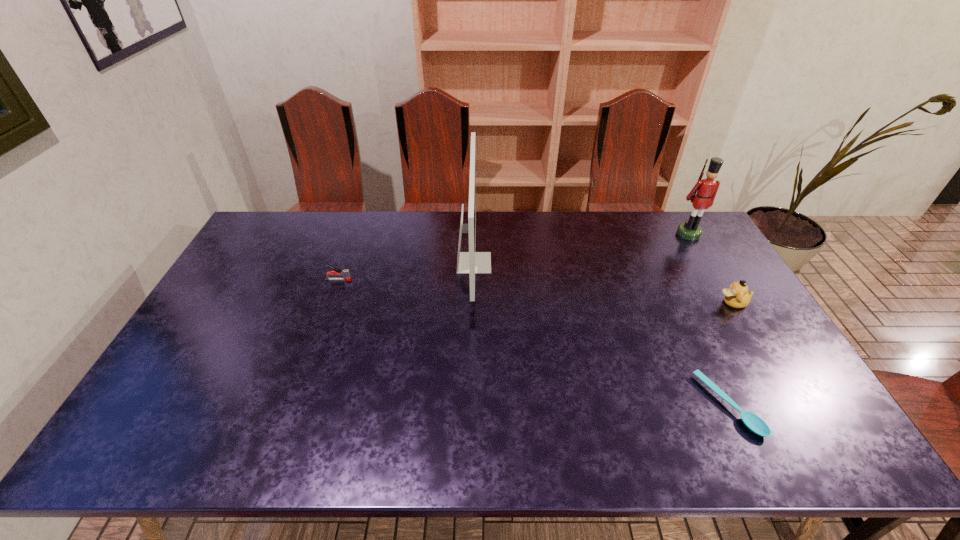
The height and width of the screenshot is (540, 960). Identify the location of vacant point located between the duckling and the third object from right to left. (730, 354).

Locate an element on the screen. The height and width of the screenshot is (540, 960). free space between the third shortest object and the monitor is located at coordinates (603, 283).

Identify the location of vacant region between the third object from left to right and the monitor. (x=601, y=334).

Find the location of a particular element. The width and height of the screenshot is (960, 540). free space between the nutcracker and the third tallest object is located at coordinates (710, 268).

Identify the location of empty space that is in between the third tallest object and the third object from left to right. (730, 354).

Identify the location of vacant area between the monitor and the third object from right to left. Image resolution: width=960 pixels, height=540 pixels. (601, 334).

The width and height of the screenshot is (960, 540). I want to click on vacant space in between the nutcracker and the duckling, so click(710, 268).

Where is `free space between the monitor and the third tallest object`? The height and width of the screenshot is (540, 960). free space between the monitor and the third tallest object is located at coordinates (603, 283).

You are a GUI agent. You are given a task and a screenshot of the screen. Output one action in this format:
    pyautogui.click(x=<x>, y=<y>)
    Task: Click on the fourth closest object to the monitor
    
    Given the screenshot: What is the action you would take?
    pyautogui.click(x=737, y=296)

This screenshot has width=960, height=540. I want to click on object that is the closest to the second object from left to right, so click(x=345, y=273).